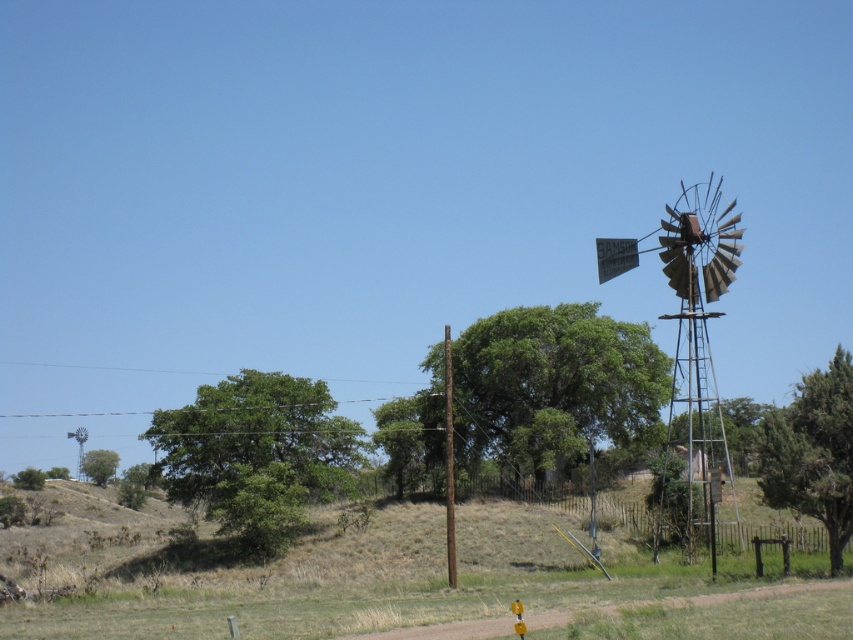
You are standing at the camera position looking at the rural landscape. There are two points marked in the image. The first point is at coordinates point [451,410] and the second point is at point [70,436]. Which of these two points is nearer to your current position?

Point [451,410] is closer to the camera than point [70,436], so the first point is nearer to your current position.

You are standing at the center of the image and want to walk towards the rusty metal windmill at right. Which direction should you move relative to the brown wooden pole at center?

The rusty metal windmill at right is positioned on the right side of the brown wooden pole at center, so you should move to the right of the brown wooden pole at center to reach it.